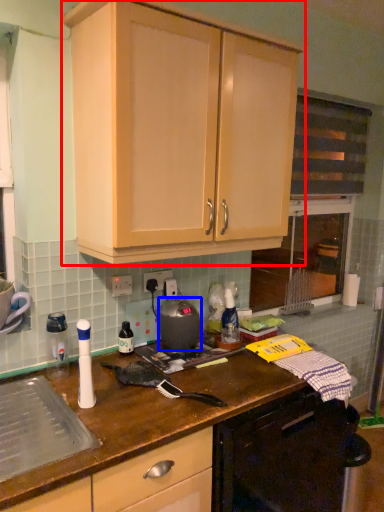
Question: Among these objects, which one is farthest to the camera, cabinetry (highlighted by a red box) or kitchen appliance (highlighted by a blue box)?

Choices:
 (A) cabinetry
 (B) kitchen appliance

Answer: (B)